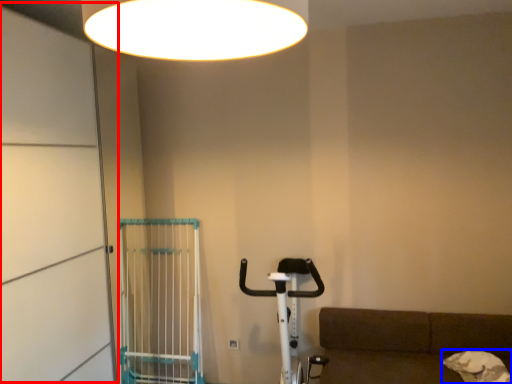
Question: Which object appears closest to the camera in this image, screen door (highlighted by a red box) or dog (highlighted by a blue box)?

Choices:
 (A) screen door
 (B) dog

Answer: (A)